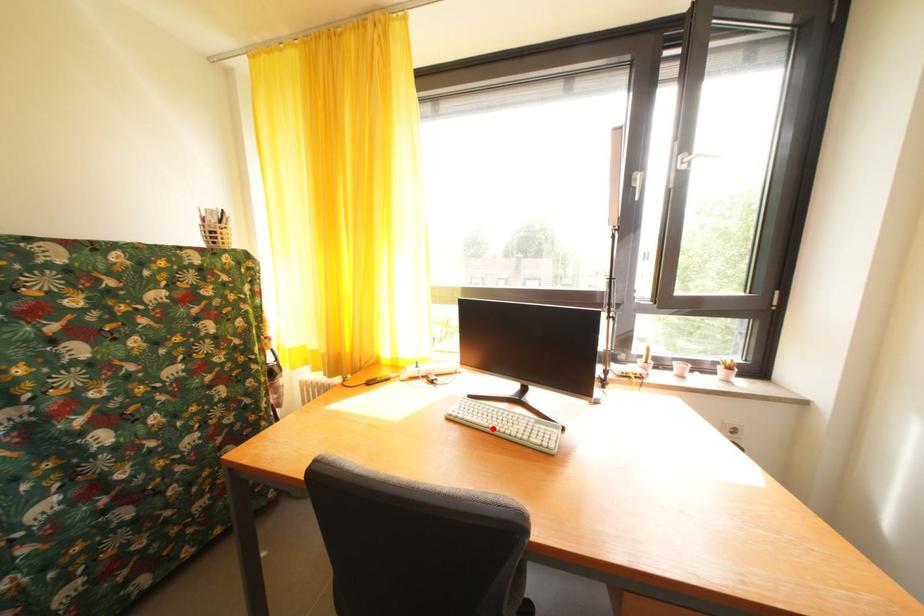
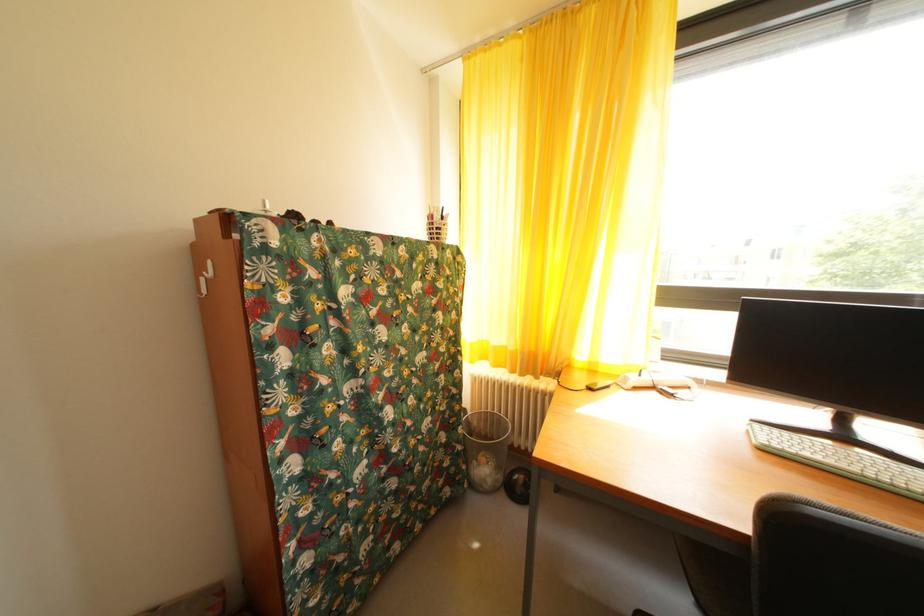
In the second image, find the point that corresponds to the highlighted location in the first image.

(854, 472)